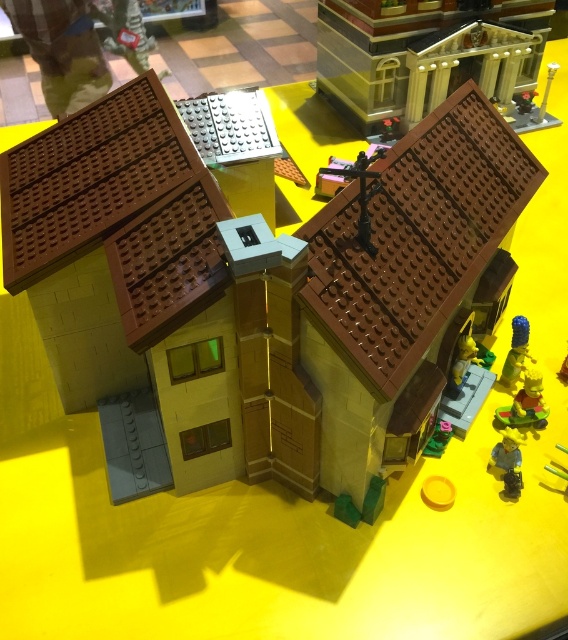
Question: Which of the following is the closest to the observer?

Choices:
 (A) (512, 355)
 (B) (508, 429)

Answer: (B)

Question: Can you confirm if matte brown house at center is positioned to the right of green plastic plant at lower right?

Choices:
 (A) yes
 (B) no

Answer: (B)

Question: Does smooth plastic figure at lower right have a lesser width compared to green plastic plant at lower right?

Choices:
 (A) yes
 (B) no

Answer: (A)

Question: Is brick-patterned building at upper center positioned in front of green plastic plant at lower right?

Choices:
 (A) yes
 (B) no

Answer: (B)

Question: Which point is closer to the camera?

Choices:
 (A) (448, 429)
 (B) (373, 104)
 (C) (528, 323)

Answer: (A)

Question: Which point appears farthest from the camera in this image?

Choices:
 (A) (508, 372)
 (B) (442, 424)
 (C) (507, 456)

Answer: (A)